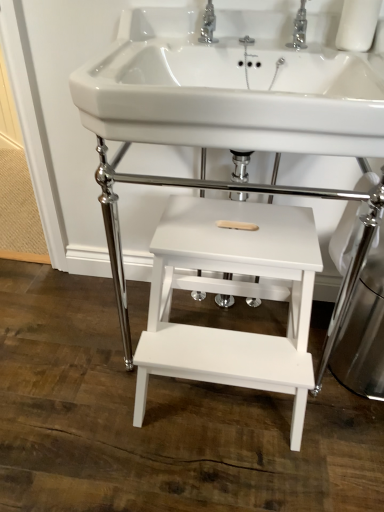
Where is `vacant area on top of white wood step stool at center, which appears as the first table when ordered from the bottom (from a real-world perspective)`? vacant area on top of white wood step stool at center, which appears as the first table when ordered from the bottom (from a real-world perspective) is located at coordinates (232, 231).